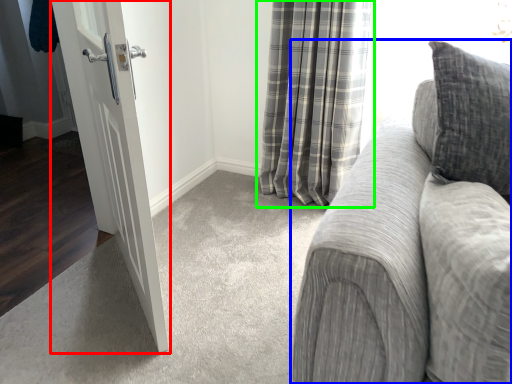
Question: Which is farther away from door (highlighted by a red box)? studio couch (highlighted by a blue box) or curtain (highlighted by a green box)?

Choices:
 (A) studio couch
 (B) curtain

Answer: (B)